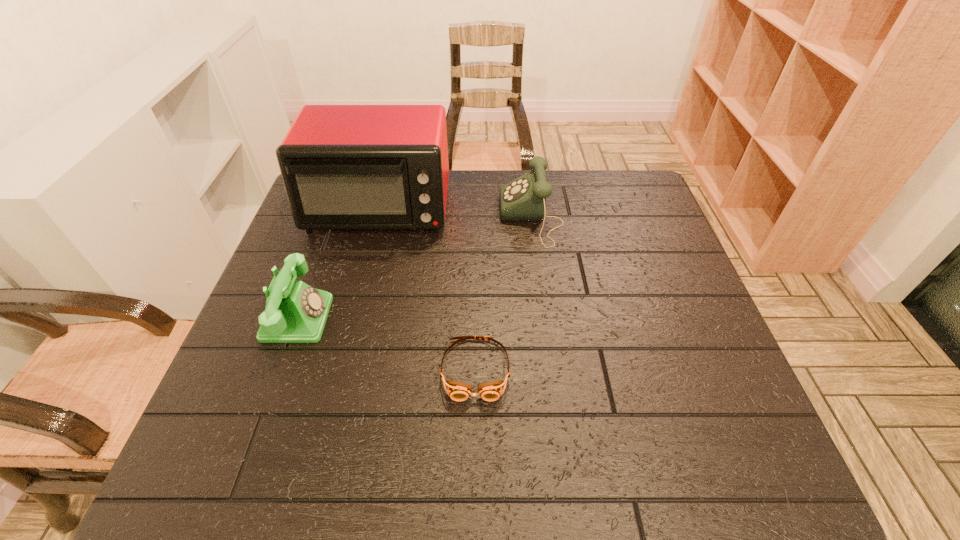
This screenshot has height=540, width=960. Find the location of `object that is the third closest to the farther telephone`. object that is the third closest to the farther telephone is located at coordinates (295, 312).

Identify which object is the closest to the nearer telephone. Please provide its 2D coordinates. Your answer should be formatted as a tuple, i.e. [(x, y)], where the tuple contains the x and y coordinates of a point satisfying the conditions above.

[(345, 167)]

This screenshot has height=540, width=960. What are the coordinates of `free space that satisfies the following two spatial constraints: 1. on the front-facing side of the toaster oven; 2. on the dial of the left telephone` in the screenshot? It's located at click(349, 318).